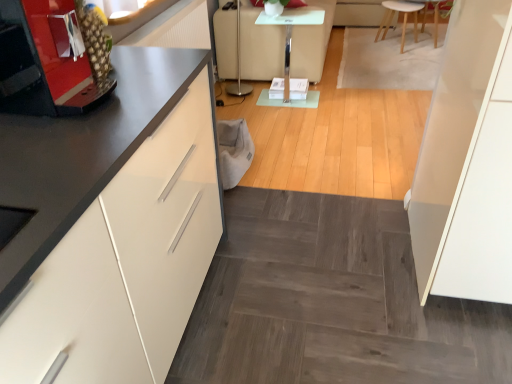
Question: Are light wood stool at upper right and clear glass table at center located far from each other?

Choices:
 (A) yes
 (B) no

Answer: (A)

Question: Is light wood stool at upper right positioned in front of clear glass table at center?

Choices:
 (A) yes
 (B) no

Answer: (B)

Question: Does light wood stool at upper right contain clear glass table at center?

Choices:
 (A) yes
 (B) no

Answer: (B)

Question: Does light wood stool at upper right have a lesser height compared to clear glass table at center?

Choices:
 (A) no
 (B) yes

Answer: (B)

Question: From a real-world perspective, is light wood stool at upper right beneath clear glass table at center?

Choices:
 (A) no
 (B) yes

Answer: (B)

Question: Is light wood stool at upper right touching clear glass table at center?

Choices:
 (A) no
 (B) yes

Answer: (A)

Question: Considering the relative sizes of clear glass table at center and white leather couch at center in the image provided, is clear glass table at center taller than white leather couch at center?

Choices:
 (A) yes
 (B) no

Answer: (B)

Question: Does clear glass table at center have a smaller size compared to white leather couch at center?

Choices:
 (A) no
 (B) yes

Answer: (B)

Question: Is clear glass table at center oriented towards white leather couch at center?

Choices:
 (A) yes
 (B) no

Answer: (B)

Question: Is the position of clear glass table at center more distant than that of white leather couch at center?

Choices:
 (A) yes
 (B) no

Answer: (B)

Question: Are clear glass table at center and white leather couch at center far apart?

Choices:
 (A) yes
 (B) no

Answer: (B)

Question: Considering the relative sizes of clear glass table at center and white leather couch at center in the image provided, is clear glass table at center shorter than white leather couch at center?

Choices:
 (A) yes
 (B) no

Answer: (A)

Question: From a real-world perspective, is metallic red coffee machine at left located beneath light wood stool at upper right?

Choices:
 (A) yes
 (B) no

Answer: (B)